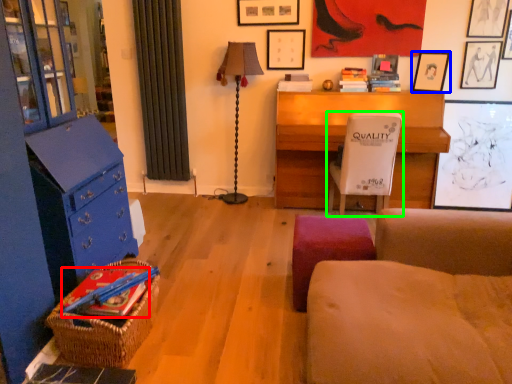
Question: Estimate the real-world distances between objects in this image. Which object is farther from book (highlighted by a red box), picture frame (highlighted by a blue box) or chair (highlighted by a green box)?

Choices:
 (A) picture frame
 (B) chair

Answer: (A)